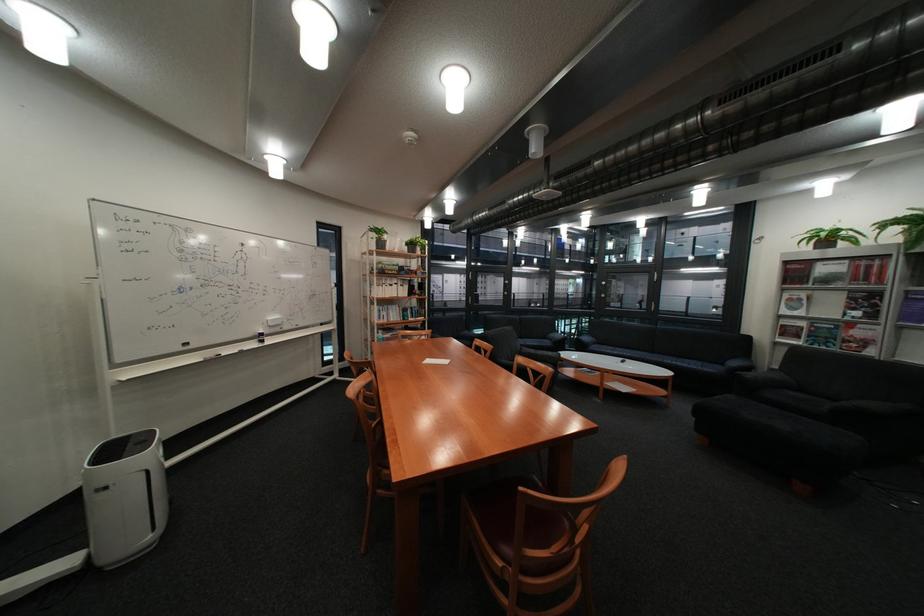
This screenshot has height=616, width=924. Describe the element at coordinates (855, 419) in the screenshot. I see `the sofa sitting surface` at that location.